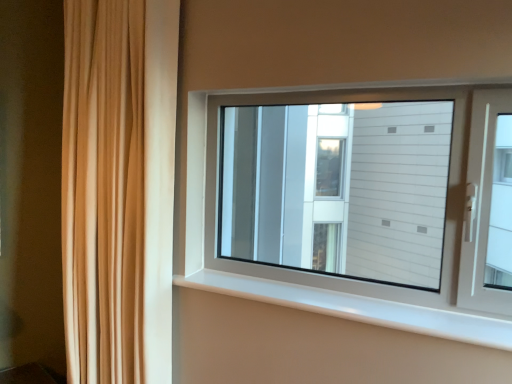
The image size is (512, 384). What do you see at coordinates (359, 307) in the screenshot?
I see `white plastic window sill at center` at bounding box center [359, 307].

At what (x,y) coordinates should I click in order to perform the action: click on white plastic window sill at center. Please return your answer as a coordinate pair (x, y). The image size is (512, 384). Looking at the image, I should click on (359, 307).

What do you see at coordinates (103, 190) in the screenshot?
I see `beige fabric curtain at left` at bounding box center [103, 190].

Image resolution: width=512 pixels, height=384 pixels. I want to click on beige fabric curtain at left, so click(103, 190).

You are a GUI agent. You are given a task and a screenshot of the screen. Output one action in this format:
    pyautogui.click(x=<x>, y=<y>)
    Task: Click on the white plastic window sill at center
    The image size is (512, 384).
    Given the screenshot: What is the action you would take?
    pyautogui.click(x=359, y=307)

Can you confirm if beige fabric curtain at left is positioned to the left of white plastic window sill at center?

Indeed, beige fabric curtain at left is positioned on the left side of white plastic window sill at center.

Which object is closer to the camera taking this photo, beige fabric curtain at left or white plastic window sill at center?

Positioned in front is white plastic window sill at center.

Is point (73, 124) farther from viewer compared to point (251, 291)?

Yes, it is behind point (251, 291).

From the image's perspective, relative to white plastic window sill at center, is beige fabric curtain at left above or below?

From the image's perspective, beige fabric curtain at left appears above white plastic window sill at center.

From a real-world perspective, who is located higher, beige fabric curtain at left or white plastic window sill at center?

beige fabric curtain at left.

Considering the sizes of beige fabric curtain at left and white plastic window sill at center in the image, is beige fabric curtain at left wider or thinner than white plastic window sill at center?

beige fabric curtain at left is wider than white plastic window sill at center.

Which of these two, beige fabric curtain at left or white plastic window sill at center, stands taller?

beige fabric curtain at left.

Who is bigger, beige fabric curtain at left or white plastic window sill at center?

beige fabric curtain at left is bigger.

Is white plastic window sill at center located within beige fabric curtain at left?

No, white plastic window sill at center is located outside of beige fabric curtain at left.

Is beige fabric curtain at left far from white plastic window sill at center?

No, beige fabric curtain at left is not far away from white plastic window sill at center.

Is beige fabric curtain at left oriented towards white plastic window sill at center?

No.

How different are the orientations of beige fabric curtain at left and white plastic window sill at center in degrees?

They differ by 0.00183 degrees in their facing directions.

Looking at this image, how distant is beige fabric curtain at left from white plastic window sill at center?

They are 24.92 inches apart.

At what (x,y) coordinates should I click in order to perform the action: click on window sill beneath the beige fabric curtain at left (from a real-world perspective). Please return your answer as a coordinate pair (x, y). Looking at the image, I should click on (359, 307).

In the scene shown: Can you confirm if white plastic window sill at center is positioned to the left of beige fabric curtain at left?

No, white plastic window sill at center is not to the left of beige fabric curtain at left.

Is white plastic window sill at center in front of or behind beige fabric curtain at left in the image?

white plastic window sill at center is positioned closer to the viewer than beige fabric curtain at left.

Is point (380, 304) behind point (135, 154)?

That is False.

From the image's perspective, relative to beige fabric curtain at left, is white plastic window sill at center above or below?

white plastic window sill at center is situated lower than beige fabric curtain at left in the image.

From a real-world perspective, relative to beige fabric curtain at left, is white plastic window sill at center vertically above or below?

white plastic window sill at center is situated lower than beige fabric curtain at left in the real world.

Which of these two, white plastic window sill at center or beige fabric curtain at left, is thinner?

With smaller width is white plastic window sill at center.

From their relative heights in the image, would you say white plastic window sill at center is taller or shorter than beige fabric curtain at left?

Considering their sizes, white plastic window sill at center has less height than beige fabric curtain at left.

Is white plastic window sill at center bigger than beige fabric curtain at left?

No, white plastic window sill at center is not bigger than beige fabric curtain at left.

Choose the correct answer: Is white plastic window sill at center inside beige fabric curtain at left or outside it?

white plastic window sill at center is not enclosed by beige fabric curtain at left.

Is white plastic window sill at center not close to beige fabric curtain at left?

white plastic window sill at center is near beige fabric curtain at left, not far away.

Looking at this image, is white plastic window sill at center positioned with its back to beige fabric curtain at left?

No, white plastic window sill at center is not facing the opposite direction of beige fabric curtain at left.

Can you tell me how much white plastic window sill at center and beige fabric curtain at left differ in facing direction?

The angular difference between white plastic window sill at center and beige fabric curtain at left is 0.00183 degrees.

At what (x,y) coordinates should I click in order to perform the action: click on curtain above the white plastic window sill at center (from a real-world perspective). Please return your answer as a coordinate pair (x, y). The height and width of the screenshot is (384, 512). Looking at the image, I should click on (103, 190).

What are the coordinates of `curtain that is above the white plastic window sill at center (from a real-world perspective)` in the screenshot? It's located at (103, 190).

Locate an element on the screen. This screenshot has height=384, width=512. curtain that is above the white plastic window sill at center (from the image's perspective) is located at coordinates [x=103, y=190].